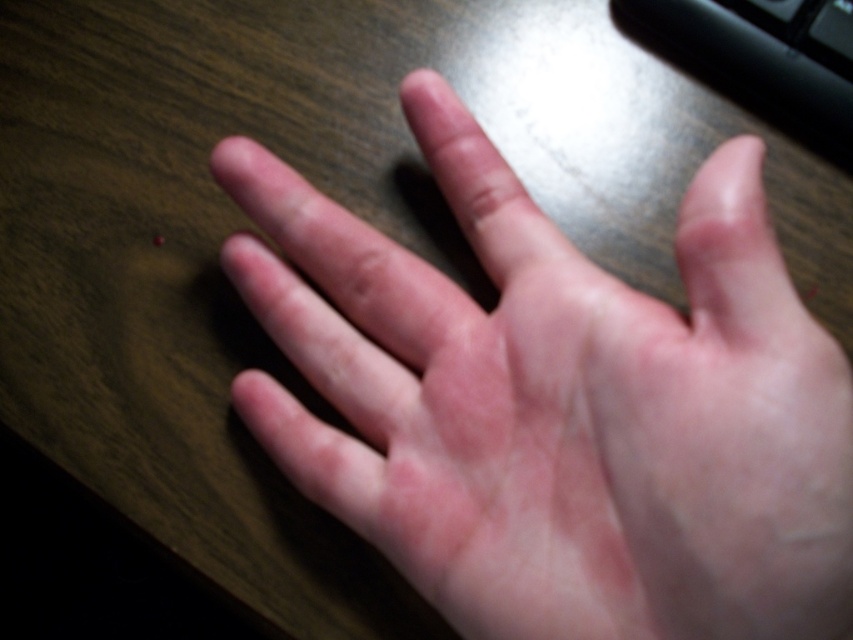
Measure the distance from pale skin hand at center to black plastic keyboard at upper right.

7.95 inches

Can you confirm if pale skin hand at center is positioned to the left of black plastic keyboard at upper right?

Indeed, pale skin hand at center is positioned on the left side of black plastic keyboard at upper right.

Image resolution: width=853 pixels, height=640 pixels. I want to click on pale skin hand at center, so click(x=558, y=404).

At what (x,y) coordinates should I click in order to perform the action: click on pale skin hand at center. Please return your answer as a coordinate pair (x, y). The height and width of the screenshot is (640, 853). Looking at the image, I should click on (558, 404).